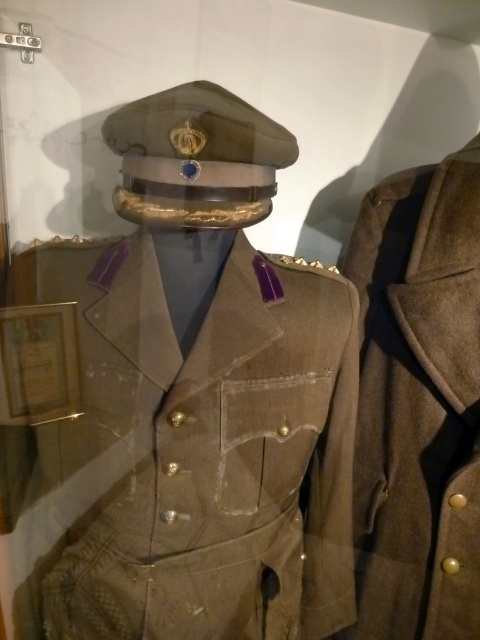
Does matte brown uniform at center appear on the left side of brown wool coat at right?

Yes, matte brown uniform at center is to the left of brown wool coat at right.

Which is behind, point (39, 470) or point (478, 257)?

Point (39, 470)

Locate an element on the screen. matte brown uniform at center is located at coordinates (179, 403).